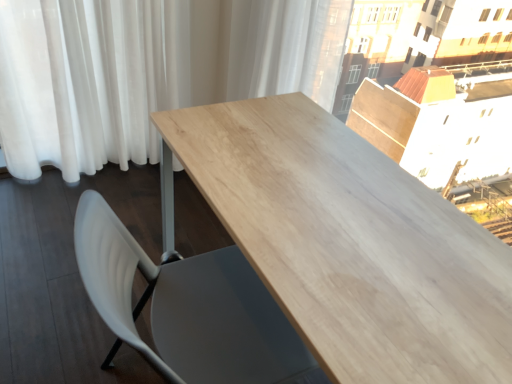
Locate an element on the screen. This screenshot has width=512, height=384. vacant area on top of white plastic chair at lower left (from a real-world perspective) is located at coordinates (65, 252).